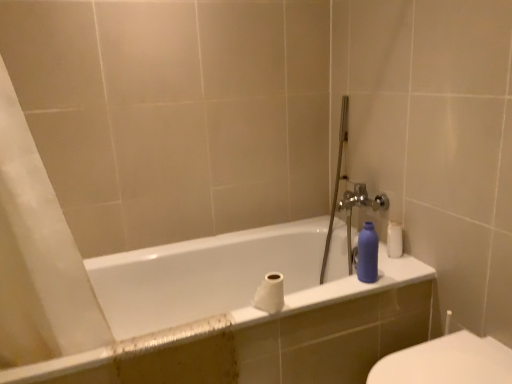
The image size is (512, 384). Identify the location of free space to the left of matte plastic bottle at right. (340, 291).